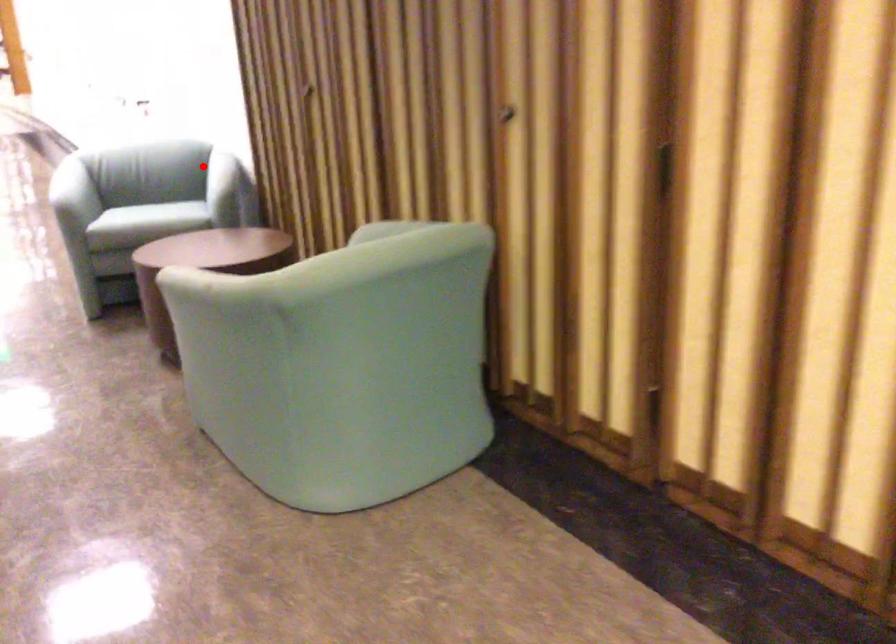
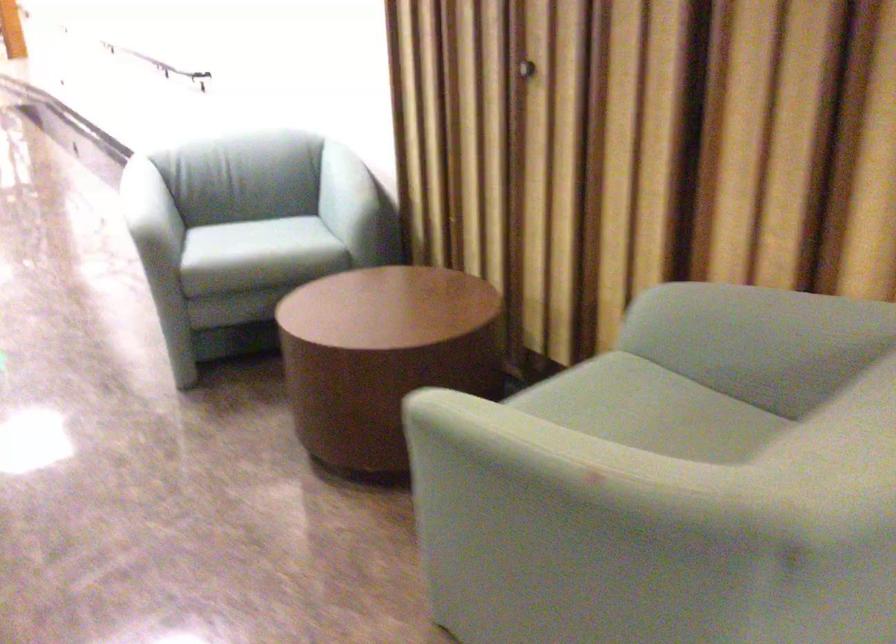
Where in the second image is the point corresponding to the highlighted location from the first image?

(346, 191)